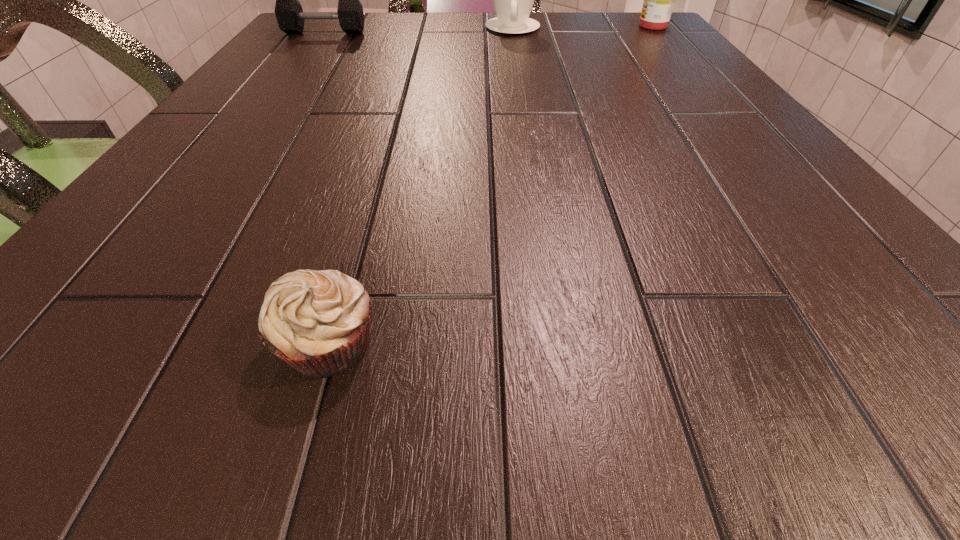
The height and width of the screenshot is (540, 960). I want to click on vacant region located on the back of the dumbbell, so click(x=339, y=15).

The width and height of the screenshot is (960, 540). In order to click on free space located on the right of the second object from left to right in this screenshot , I will do `click(547, 343)`.

The width and height of the screenshot is (960, 540). Identify the location of fruit juice at the far edge. pyautogui.click(x=659, y=0).

Image resolution: width=960 pixels, height=540 pixels. I want to click on cappuccino that is at the far edge, so click(x=513, y=0).

Find the location of a particular element. Image resolution: width=960 pixels, height=540 pixels. dumbbell present at the far edge is located at coordinates (290, 17).

Locate an element on the screen. object that is at the near edge is located at coordinates (318, 322).

Image resolution: width=960 pixels, height=540 pixels. I want to click on object that is at the left edge, so click(290, 17).

Locate an element on the screen. The height and width of the screenshot is (540, 960). object located in the right edge section of the desktop is located at coordinates (659, 0).

This screenshot has height=540, width=960. What are the coordinates of `object at the far left corner` in the screenshot? It's located at (290, 17).

At what (x,y) coordinates should I click in order to perform the action: click on object at the far right corner. Please return your answer as a coordinate pair (x, y). Image resolution: width=960 pixels, height=540 pixels. Looking at the image, I should click on (659, 0).